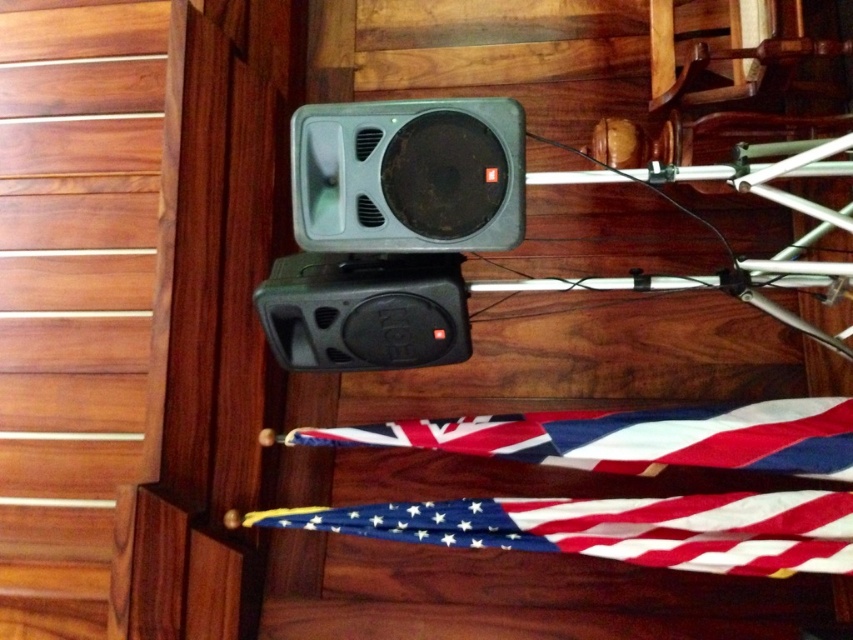
Does point (489, 224) lie in front of point (705, 508)?

Yes, it is.

Find the location of a particular element. Image resolution: width=853 pixels, height=640 pixels. matte black speaker at center is located at coordinates (408, 176).

Who is more distant from viewer, (426, 147) or (830, 547)?

Positioned behind is point (830, 547).

Where is `matte black speaker at center`? matte black speaker at center is located at coordinates (408, 176).

Who is positioned more to the left, wooden panel at upper left or matte black speaker at center?

wooden panel at upper left

Who is positioned more to the right, wooden panel at upper left or matte black speaker at center?

matte black speaker at center is more to the right.

Is point (123, 112) positioned after point (306, 248)?

Yes, it is behind point (306, 248).

Find the location of a particular element. wooden panel at upper left is located at coordinates (82, 298).

Looking at this image, can you confirm if matte black speaker at center is smaller than polyester flag at lower center?

Yes.

Does matte black speaker at center appear on the left side of polyester flag at lower center?

Yes, matte black speaker at center is to the left of polyester flag at lower center.

Between point (368, 177) and point (752, 456), which one is positioned behind?

Point (752, 456)

The width and height of the screenshot is (853, 640). What are the coordinates of `matte black speaker at center` in the screenshot? It's located at (408, 176).